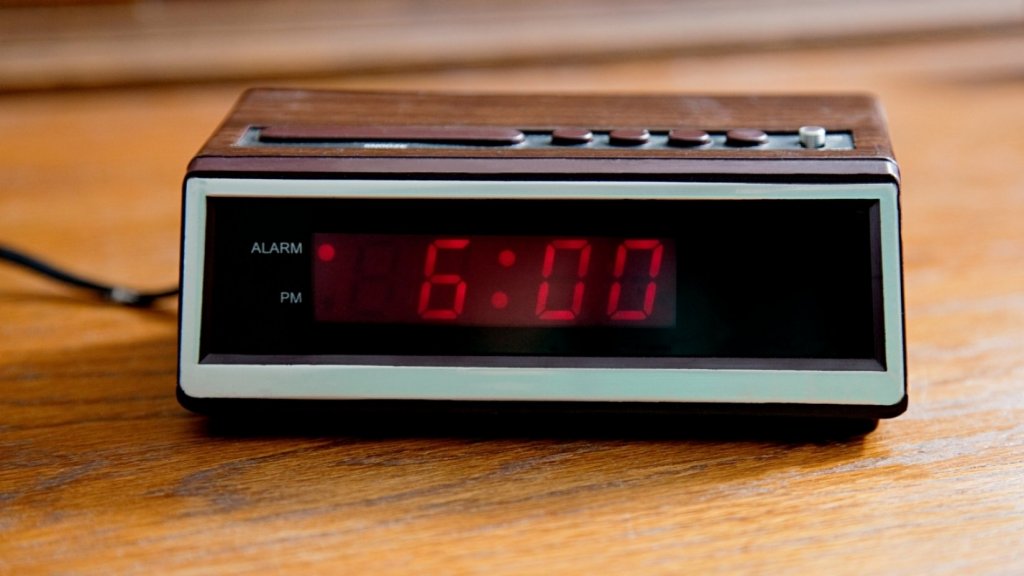
The height and width of the screenshot is (576, 1024). In order to click on white border around the face of the alarm clock in this screenshot , I will do `click(362, 382)`.